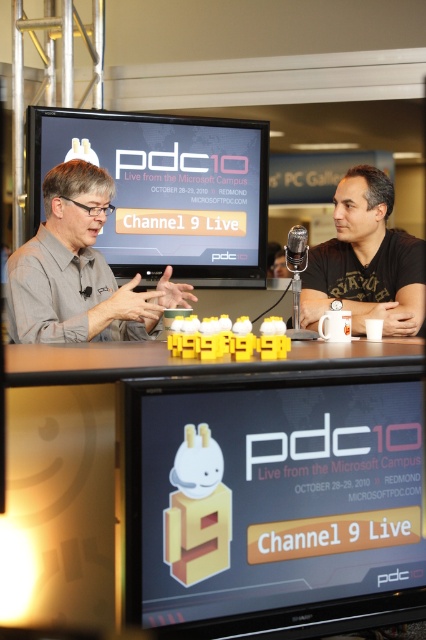
You are attending the PDC10 event and notice a person wearing a gray matte shirt at left. Where exactly is this shirt located in relation to the large screen displaying the PDC10 branding?

The gray matte shirt at left is located at point 0.423 on the x and 0.185 on the y coordinate relative to the large screen displaying the PDC10 branding.